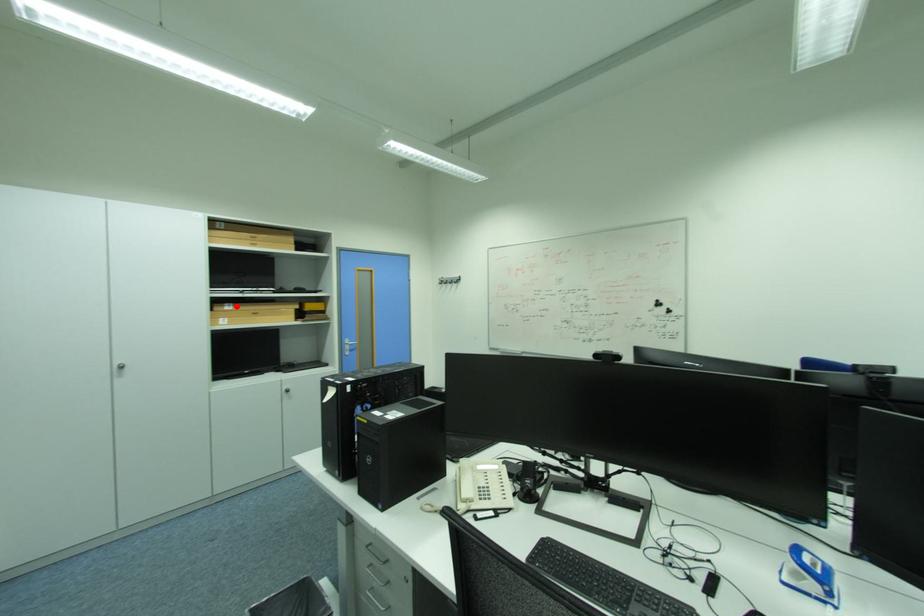
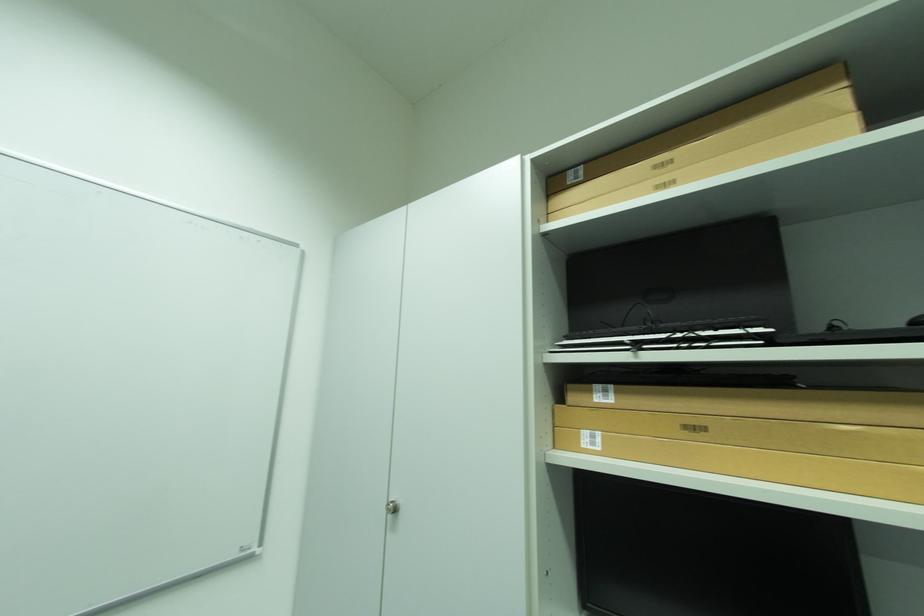
In the second image, find the point that corresponds to the highlighted location in the first image.

(614, 392)